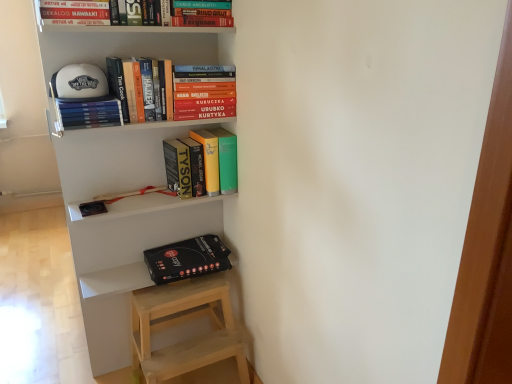
Question: From a real-world perspective, is white matte bookshelf at upper center on black matte box at lower left?

Choices:
 (A) no
 (B) yes

Answer: (B)

Question: Would you say white matte bookshelf at upper center is outside black matte box at lower left?

Choices:
 (A) yes
 (B) no

Answer: (A)

Question: From the image's perspective, is white matte bookshelf at upper center on black matte box at lower left?

Choices:
 (A) no
 (B) yes

Answer: (B)

Question: Is the depth of white matte bookshelf at upper center less than that of black matte box at lower left?

Choices:
 (A) no
 (B) yes

Answer: (B)

Question: Can you confirm if white matte bookshelf at upper center is positioned to the left of black matte box at lower left?

Choices:
 (A) no
 (B) yes

Answer: (B)

Question: In the image, is hardcover books at upper left, which is counted as the second book, starting from the bottom, positioned in front of or behind black matte box at lower left?

Choices:
 (A) behind
 (B) front

Answer: (B)

Question: Looking at the image, does hardcover books at upper left, which is counted as the second book, starting from the bottom, seem bigger or smaller compared to black matte box at lower left?

Choices:
 (A) small
 (B) big

Answer: (A)

Question: From their relative heights in the image, would you say hardcover books at upper left, which is the fourth book from top to bottom, is taller or shorter than black matte box at lower left?

Choices:
 (A) tall
 (B) short

Answer: (B)

Question: Is hardcover books at upper left, which is the fourth book from top to bottom, inside the boundaries of black matte box at lower left, or outside?

Choices:
 (A) outside
 (B) inside

Answer: (A)

Question: Relative to hardcover books at upper left, arranged as the 2th book when viewed from the top, is matte yellow book at center, the 1th book from the bottom, in front or behind?

Choices:
 (A) front
 (B) behind

Answer: (B)

Question: From a real-world perspective, is matte yellow book at center, the 5th book in the top-to-bottom sequence, physically located above or below hardcover books at upper left, which is the fourth book from bottom to top?

Choices:
 (A) below
 (B) above

Answer: (A)

Question: Is matte yellow book at center, the 1th book from the bottom, inside or outside of hardcover books at upper left, which is the fourth book from bottom to top?

Choices:
 (A) inside
 (B) outside

Answer: (B)

Question: From the image's perspective, relative to hardcover books at upper left, which is the fourth book from bottom to top, is matte yellow book at center, the 1th book from the bottom, above or below?

Choices:
 (A) above
 (B) below

Answer: (B)

Question: Is hardcover book at upper center, the first book in the top-to-bottom sequence, in front of or behind hardcover books at upper left, which is counted as the second book, starting from the bottom, in the image?

Choices:
 (A) behind
 (B) front

Answer: (B)

Question: From a real-world perspective, relative to hardcover books at upper left, which is counted as the second book, starting from the bottom, is hardcover book at upper center, the first book in the top-to-bottom sequence, vertically above or below?

Choices:
 (A) below
 (B) above

Answer: (B)